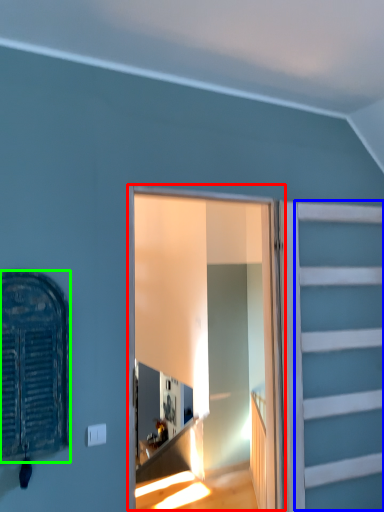
Question: Considering the real-world distances, which object is farthest from window frame (highlighted by a red box)? garage door (highlighted by a blue box) or window (highlighted by a green box)?

Choices:
 (A) garage door
 (B) window

Answer: (B)